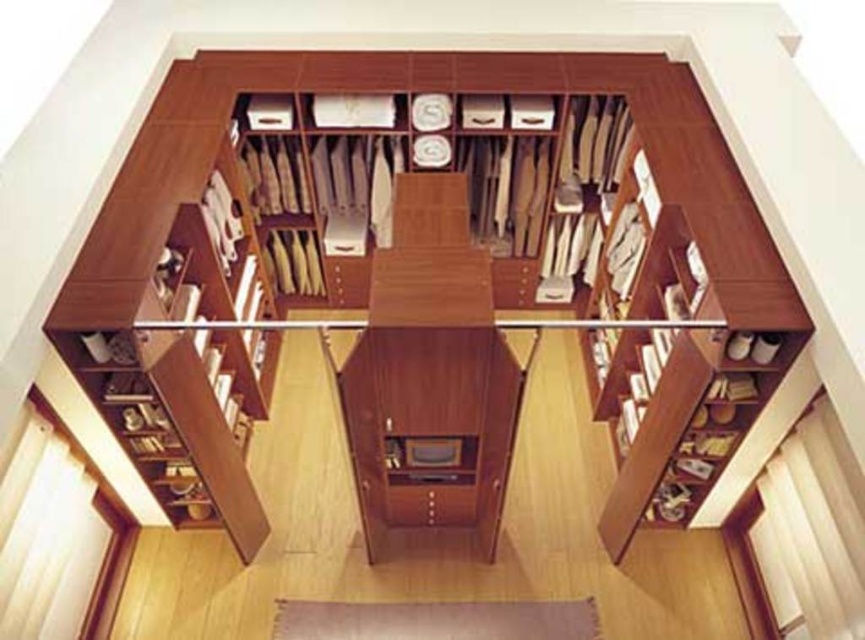
You are a delivery person who just received a package that is 2 meters long. You need to place it horizontally in the closet. Can you fit the package between the wooden bookshelf at center and the matte wood drawer at center?

The distance between the wooden bookshelf at center and the matte wood drawer at center is 1.92 meters. Since the package is 2 meters long, which is slightly longer than the available space, it won

Based on the scene description, where is the wooden bookshelf at center located in terms of its 2D coordinates?

The wooden bookshelf at center is located at the 2D coordinates of point [425,90].

You are standing in the walk in closet and want to place a new item on the point that is closer to you. Which point should you choose between the point at (209, 80) and the point at (452, 524)?

You should choose the point at (209, 80) because it is closer to you than the point at (452, 524).